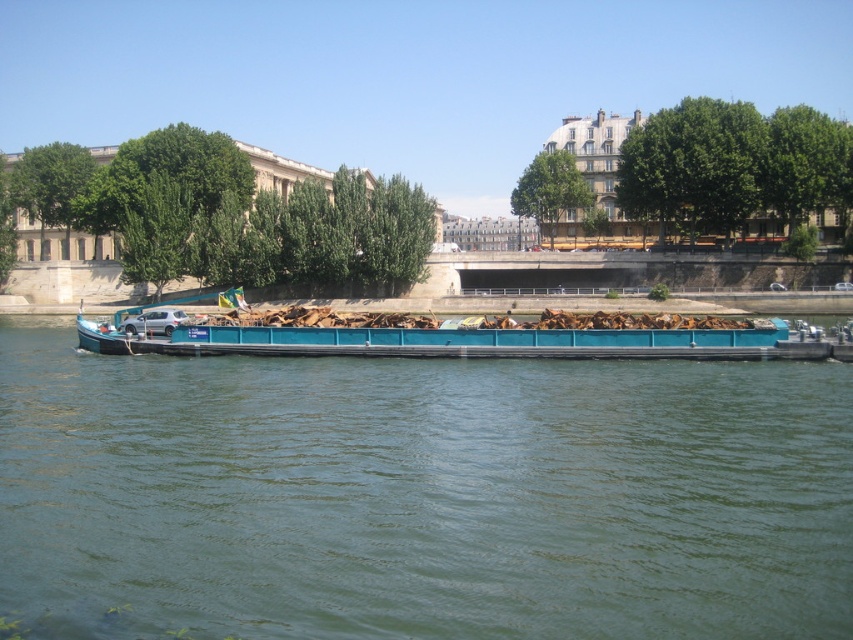
Consider the image. Does teal metallic barge at center have a greater width compared to teal matte barge at center?

Yes, teal metallic barge at center is wider than teal matte barge at center.

Does teal metallic barge at center have a smaller size compared to teal matte barge at center?

No, teal metallic barge at center is not smaller than teal matte barge at center.

Find the location of a particular element. teal metallic barge at center is located at coordinates (419, 496).